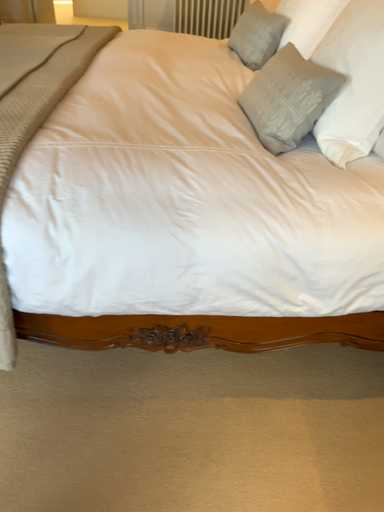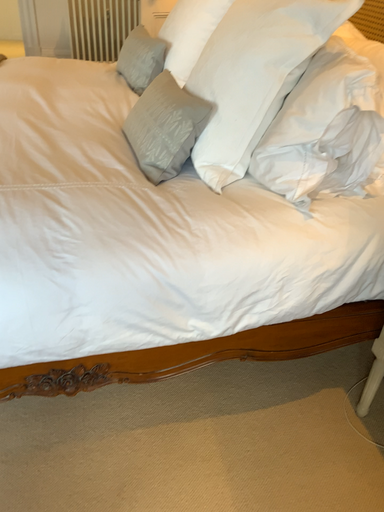
Question: How did the camera likely rotate when shooting the video?

Choices:
 (A) rotated right
 (B) rotated left

Answer: (A)